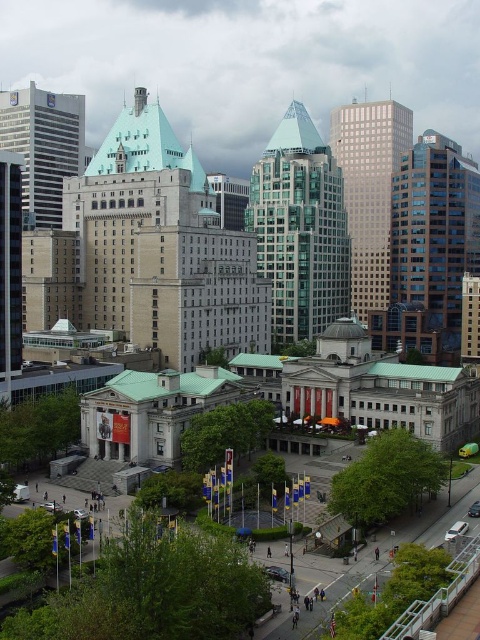
Question: Which point appears farthest from the camera in this image?

Choices:
 (A) (427, 269)
 (B) (26, 108)
 (C) (300, 332)
 (D) (379, 272)

Answer: (D)

Question: Which of the following is the closest to the observer?

Choices:
 (A) 97,317
 (B) 275,284
 (C) 417,285
 (D) 47,211

Answer: (A)

Question: Considering the real-world distances, which object is farthest from the teal glass tower at center?

Choices:
 (A) beige stone tower at center
 (B) glassy reflective skyscraper at center

Answer: (A)

Question: Does matte silver skyscraper at left lie in front of matte glass skyscraper at left?

Choices:
 (A) yes
 (B) no

Answer: (B)

Question: Observing the image, what is the correct spatial positioning of blue glass skyscraper at right in reference to glassy reflective skyscraper at center?

Choices:
 (A) left
 (B) right

Answer: (B)

Question: Does glassy reflective skyscraper at center appear on the right side of matte silver skyscraper at left?

Choices:
 (A) no
 (B) yes

Answer: (B)